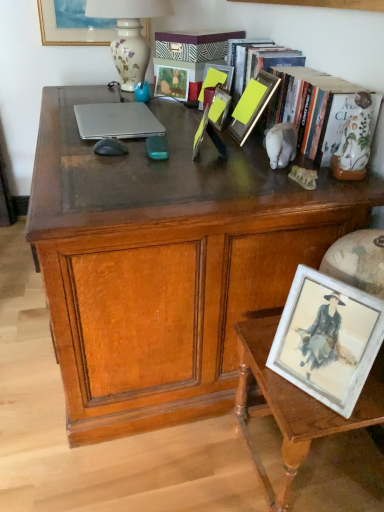
Identify the location of free point to the left of transparent plastic mobile phone at center. (99, 153).